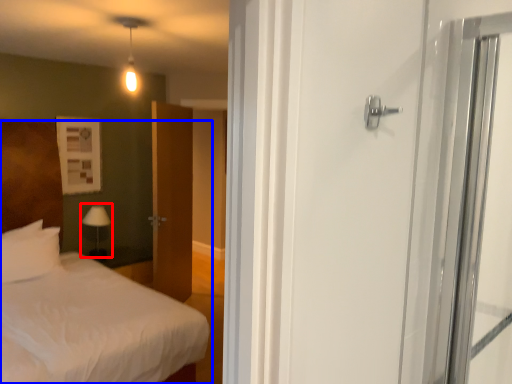
Question: Which point is closer to the camera, table lamp (highlighted by a red box) or bed (highlighted by a blue box)?

Choices:
 (A) table lamp
 (B) bed

Answer: (B)